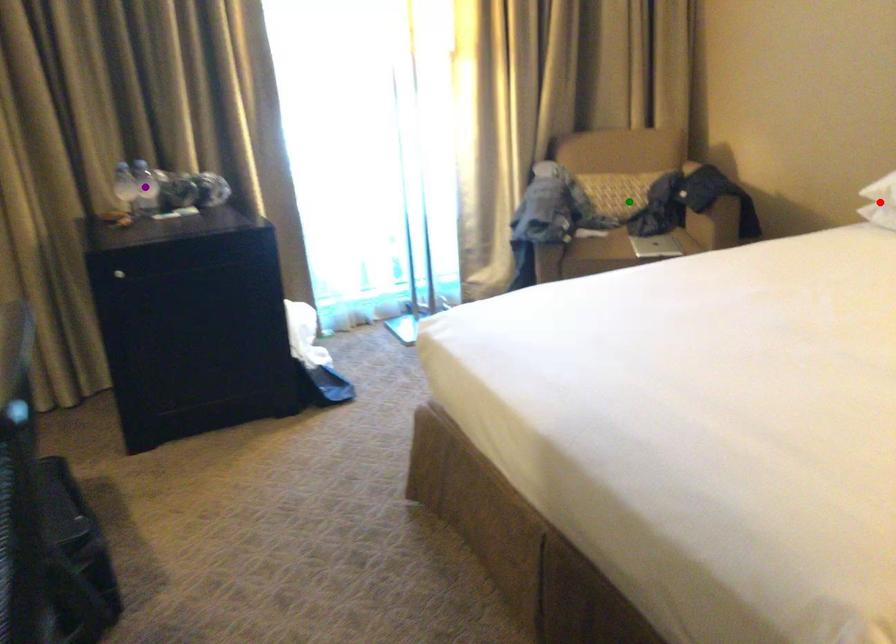
Order these from nearest to farthest:
A) green point
B) purple point
C) red point

red point → purple point → green point